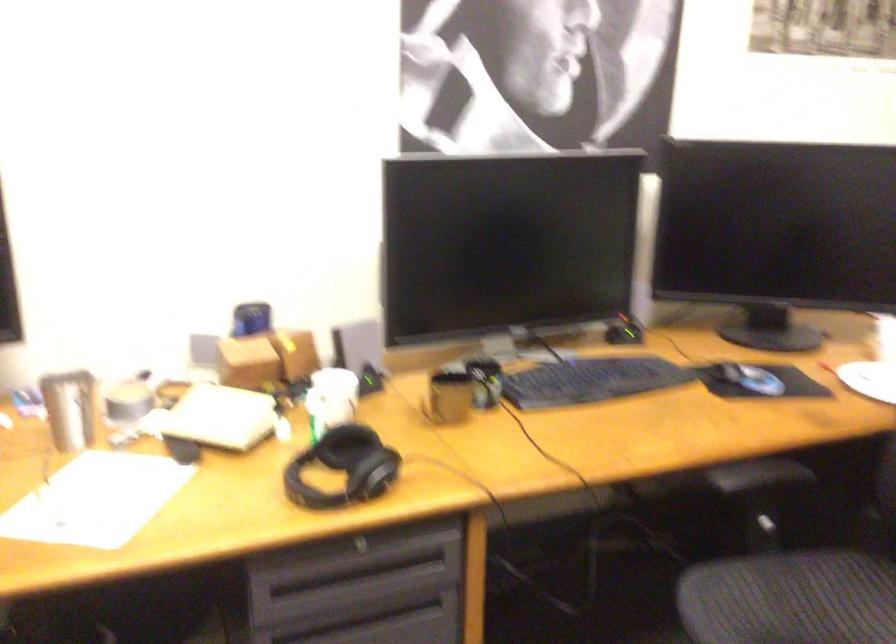
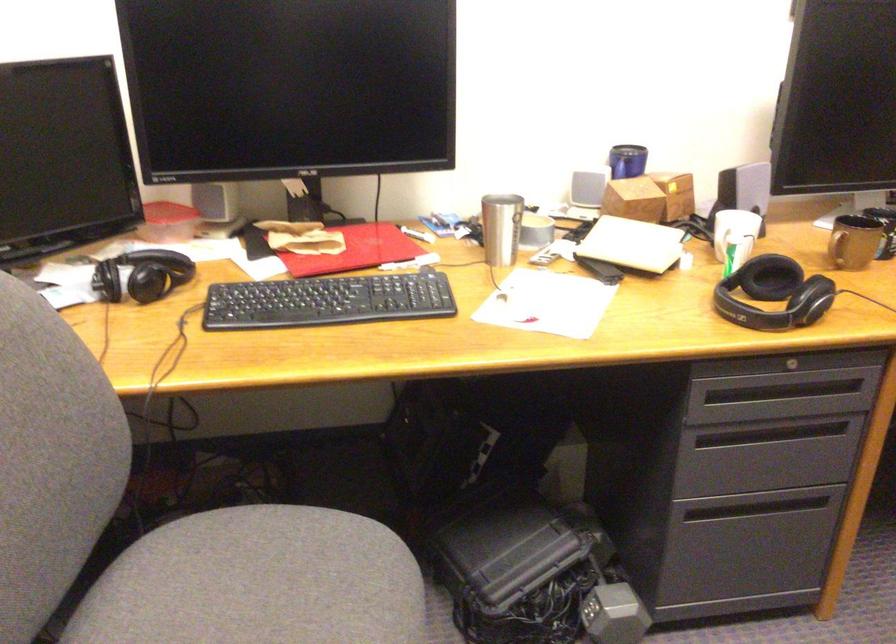
Where in the second image is the point corresponding to point (371, 480) from the first image?

(810, 299)